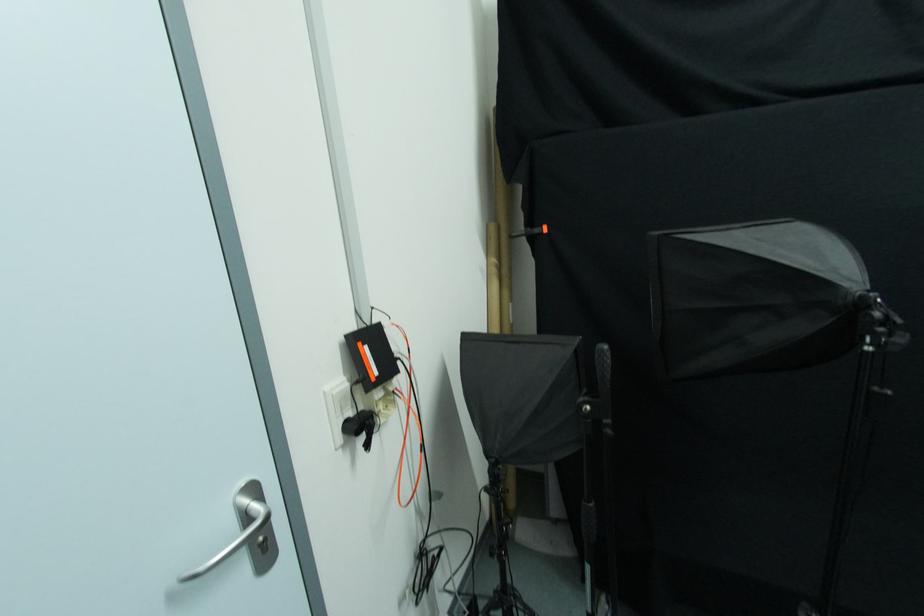
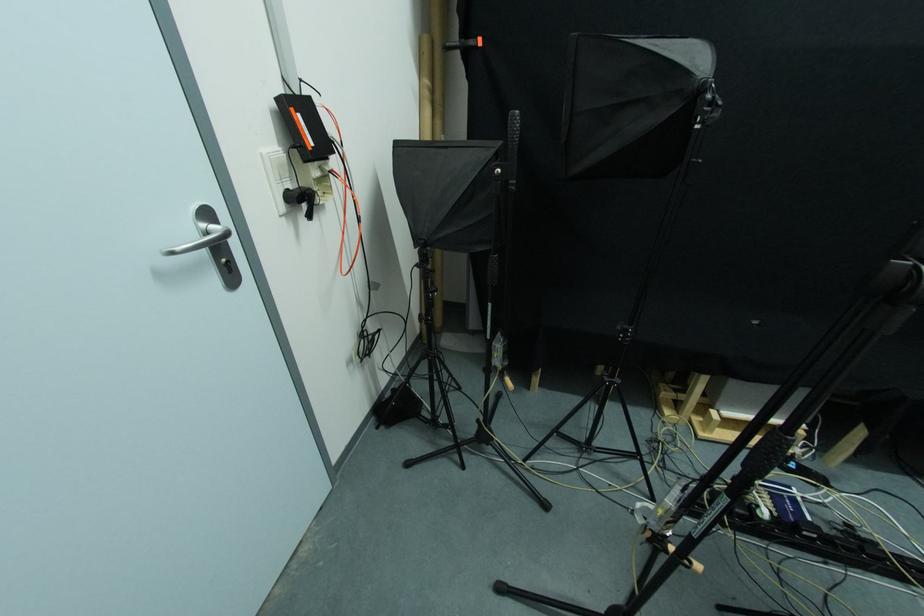
Find the pixel in the second image that matches (x=610, y=428) in the first image.

(515, 187)